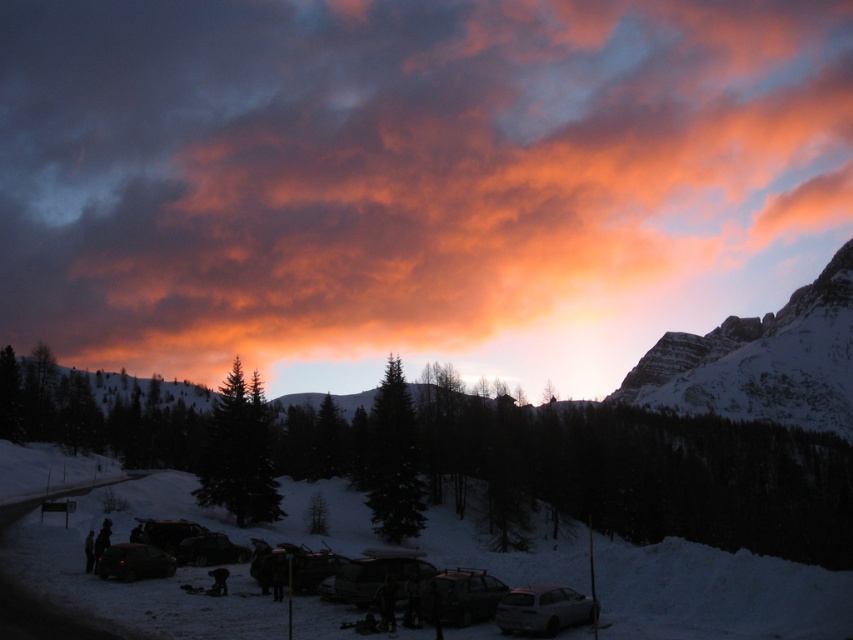
Question: Does orange cotton clouds at upper center have a greater width compared to metallic silver car at lower center?

Choices:
 (A) yes
 (B) no

Answer: (A)

Question: Which point is farther from the camera taking this photo?

Choices:
 (A) (496, 582)
 (B) (500, 600)
 (C) (161, 572)
 (D) (207, 518)

Answer: (D)

Question: Among these points, which one is nearest to the camera?

Choices:
 (A) (769, 356)
 (B) (120, 552)
 (C) (451, 592)
 (D) (51, 552)

Answer: (C)

Question: Does orange cotton clouds at upper center appear on the left side of white powdery snow at lower center?

Choices:
 (A) no
 (B) yes

Answer: (B)

Question: Is white powdery snow at lower center positioned at the back of snowy rock mountain at upper right?

Choices:
 (A) yes
 (B) no

Answer: (B)

Question: Which is nearer to the snowy rock mountain at upper right?

Choices:
 (A) white powdery snow at lower center
 (B) orange cotton clouds at upper center

Answer: (A)